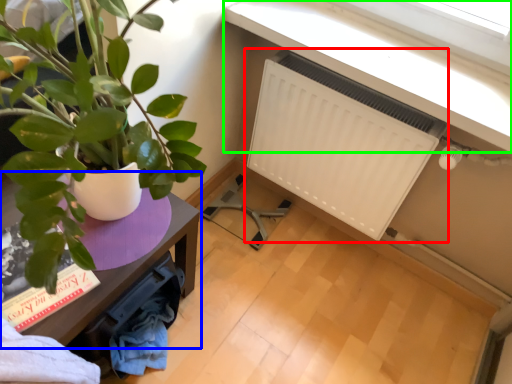
Question: Which is nearer to the radiator (highlighted by a red box)? table (highlighted by a blue box) or window sill (highlighted by a green box).

Choices:
 (A) table
 (B) window sill

Answer: (B)